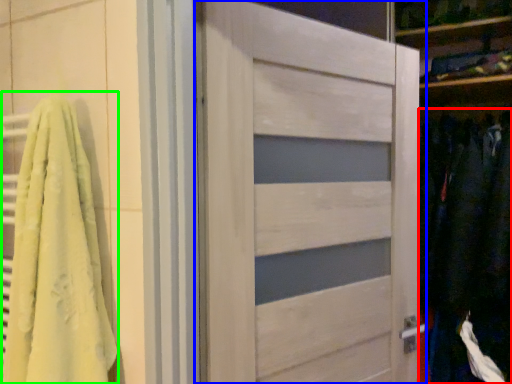
Question: Which object is positioned farthest from clothing (highlighted by a red box)? Select from door (highlighted by a blue box) and bath towel (highlighted by a green box).

Choices:
 (A) door
 (B) bath towel

Answer: (B)